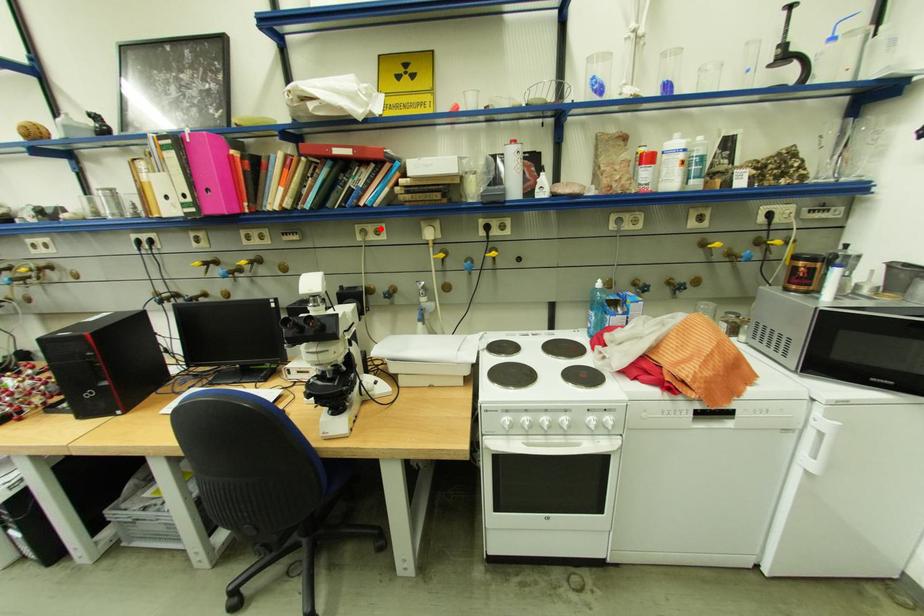
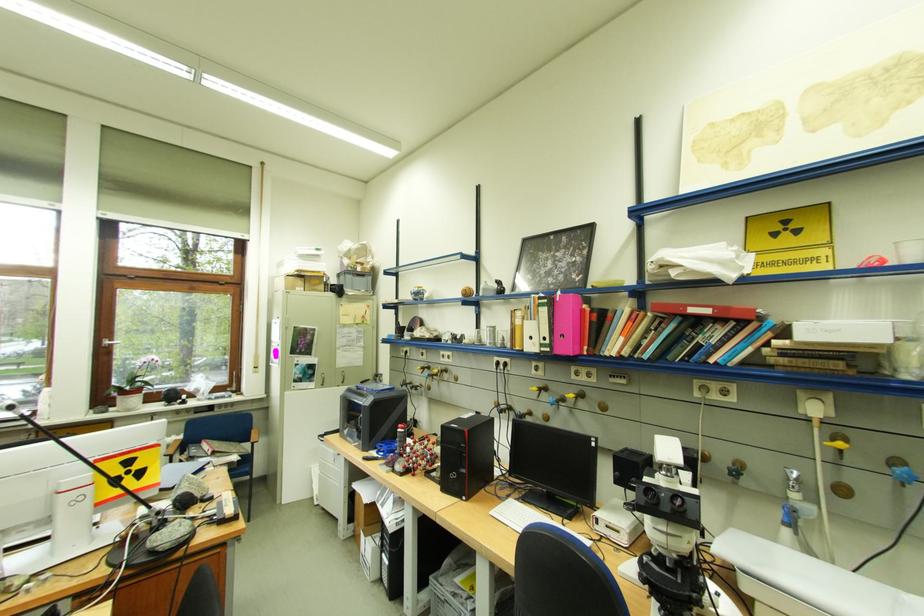
Locate, in the second image, the point that corresponds to the highlighted location in the first image.

(724, 387)